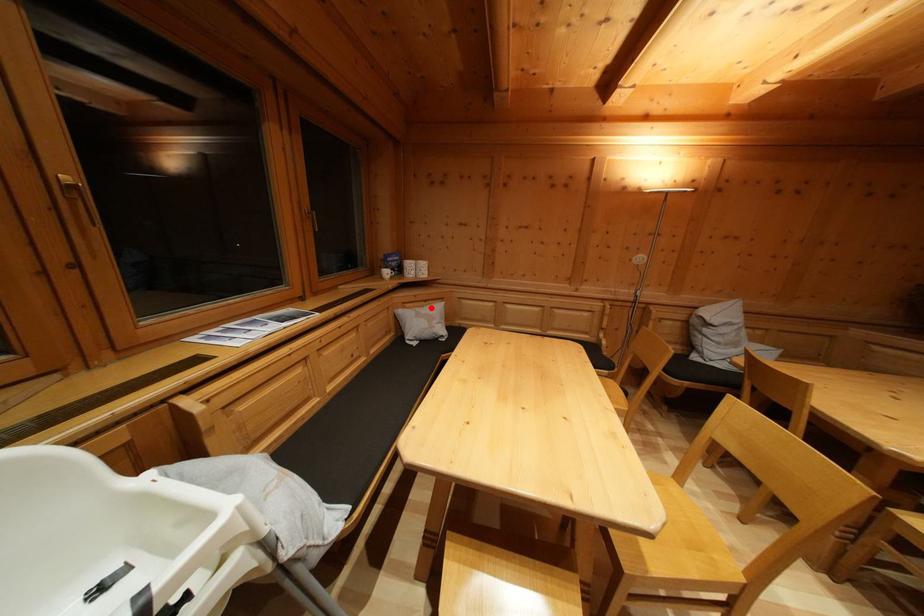
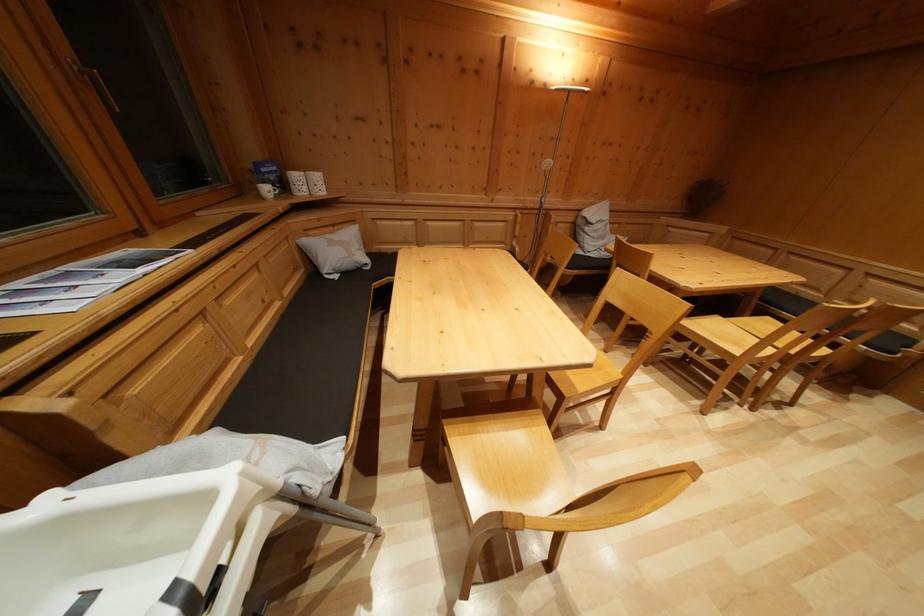
In the second image, find the point that corresponds to the highlighted location in the first image.

(338, 233)